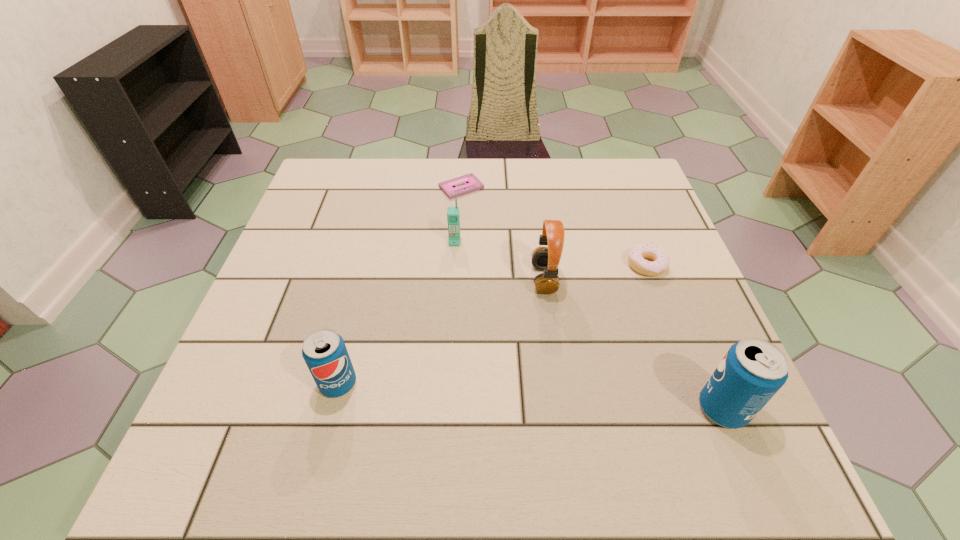
You are a GUI agent. You are given a task and a screenshot of the screen. Output one action in this format:
    pyautogui.click(x=<x>, y=<y>)
    Task: Click on the vacant space positioned 0.140m on the left of the farthest object
    
    Given the screenshot: What is the action you would take?
    pyautogui.click(x=389, y=187)

Find the location of a particular element. The width and height of the screenshot is (960, 540). vacant area situated on the keypad of the fifth nearest object is located at coordinates (449, 337).

Find the location of a particular element. vacant space situated on the left of the doughnut is located at coordinates (507, 265).

Identify the location of free region located 0.110m on the ear cups of the third object from right to left. (483, 279).

The width and height of the screenshot is (960, 540). I want to click on free space located 0.290m on the ear cups of the third object from right to left, so click(x=403, y=279).

Find the location of `free point located on the ear cups of the third object from right to left`. free point located on the ear cups of the third object from right to left is located at coordinates (461, 279).

What are the coordinates of `object present at the far edge` in the screenshot? It's located at (472, 183).

Where is `soda can located in the right edge section of the desktop`? Image resolution: width=960 pixels, height=540 pixels. soda can located in the right edge section of the desktop is located at coordinates (753, 370).

Where is `doughnut located in the right edge section of the desktop`? doughnut located in the right edge section of the desktop is located at coordinates 636,256.

Find the location of a particular element. object located in the near right corner section of the desktop is located at coordinates (753, 370).